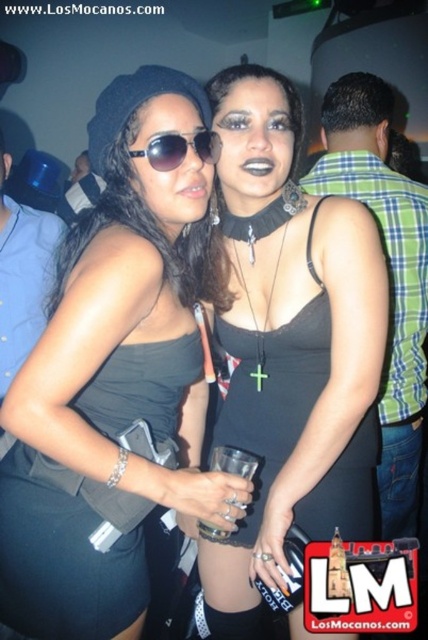
Question: Does matte black dress at center appear over black matte dress at center?

Choices:
 (A) no
 (B) yes

Answer: (B)

Question: Which object is closer to the camera taking this photo?

Choices:
 (A) black satin dress at center
 (B) black matte dress at center

Answer: (A)

Question: Which of the following is the farthest from the observer?

Choices:
 (A) black satin dress at center
 (B) sunglasses at center
 (C) matte black dress at center

Answer: (A)

Question: Estimate the real-world distances between objects in this image. Which object is farther from the matte black dress at center?

Choices:
 (A) black matte dress at center
 (B) black satin dress at center

Answer: (A)

Question: Considering the relative positions of matte black dress at center and black satin dress at center in the image provided, where is matte black dress at center located with respect to black satin dress at center?

Choices:
 (A) above
 (B) below

Answer: (A)

Question: Is matte black dress at center further to camera compared to black satin dress at center?

Choices:
 (A) no
 (B) yes

Answer: (A)